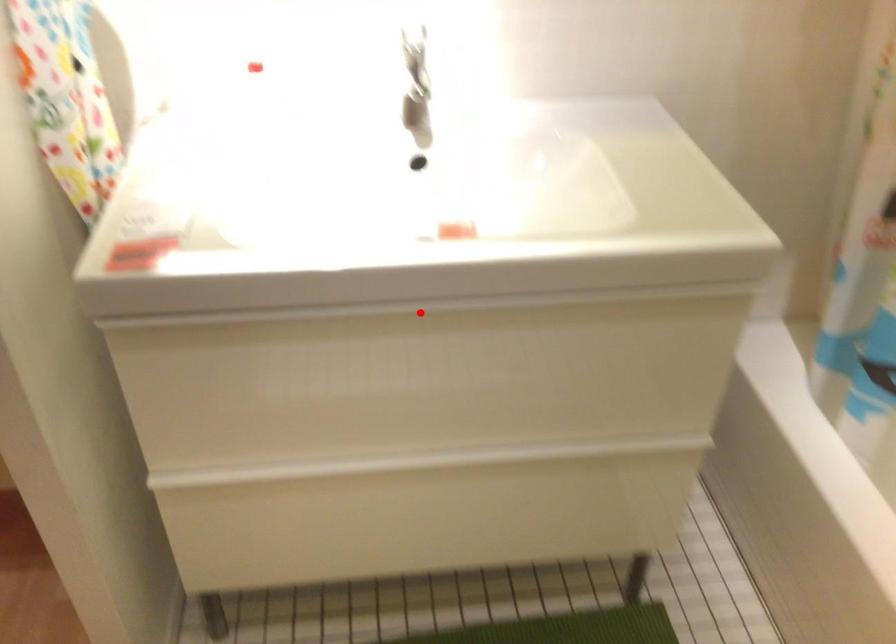
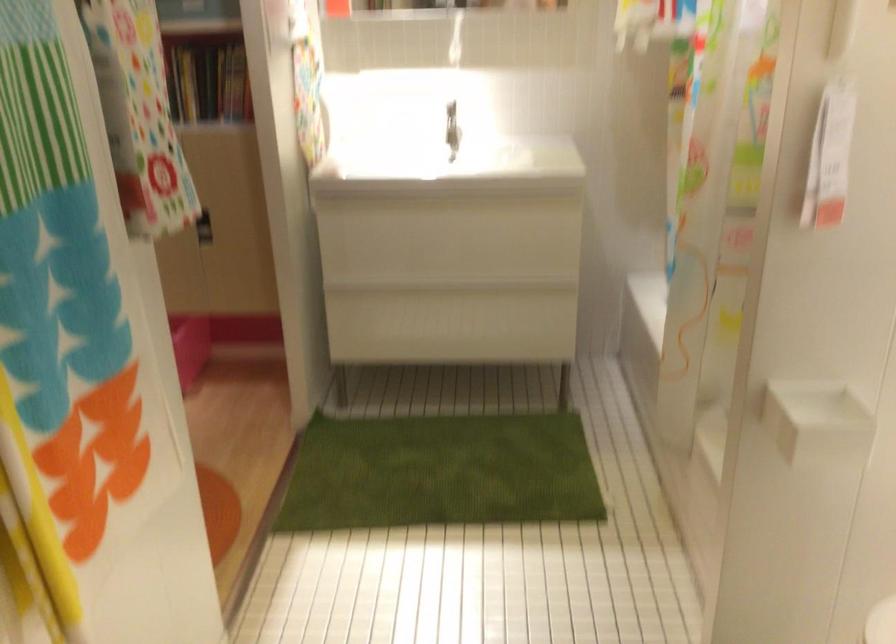
Question: A red point is marked in image1. In image2, is the corresponding 3D point closer to the camera or farther? Reply with the corresponding letter.

Choices:
 (A) The corresponding 3D point is closer.
 (B) The corresponding 3D point is farther.

Answer: (B)